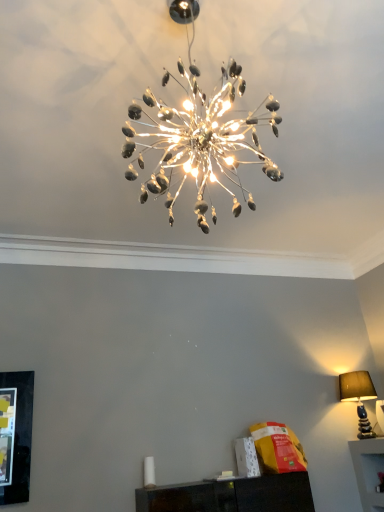
Question: Is matte brown lampshade at right, the second lamp positioned from the top, to the left or to the right of metallic silver chandelier at center, which is counted as the first lamp, starting from the front, in the image?

Choices:
 (A) right
 (B) left

Answer: (A)

Question: From a real-world perspective, is matte brown lampshade at right, the second lamp positioned from the top, physically located above or below metallic silver chandelier at center, which is the 1th lamp from top to bottom?

Choices:
 (A) above
 (B) below

Answer: (B)

Question: Considering their positions, is matte brown lampshade at right, marked as the first lamp in a right-to-left arrangement, located in front of or behind metallic silver chandelier at center, placed as the second lamp when sorted from back to front?

Choices:
 (A) front
 (B) behind

Answer: (B)

Question: Which is correct: metallic silver chandelier at center, which is counted as the second lamp, starting from the right, is inside matte brown lampshade at right, the second lamp positioned from the top, or outside of it?

Choices:
 (A) inside
 (B) outside

Answer: (B)

Question: From a real-world perspective, is metallic silver chandelier at center, which is the 1th lamp from top to bottom, physically located above or below matte brown lampshade at right, which is the first lamp in bottom-to-top order?

Choices:
 (A) below
 (B) above

Answer: (B)

Question: Considering the positions of point (281, 175) and point (369, 377), is point (281, 175) closer or farther from the camera than point (369, 377)?

Choices:
 (A) closer
 (B) farther

Answer: (A)

Question: Would you say metallic silver chandelier at center, which ranks as the 1th lamp in left-to-right order, is to the left or to the right of matte brown lampshade at right, marked as the first lamp in a right-to-left arrangement, in the picture?

Choices:
 (A) left
 (B) right

Answer: (A)